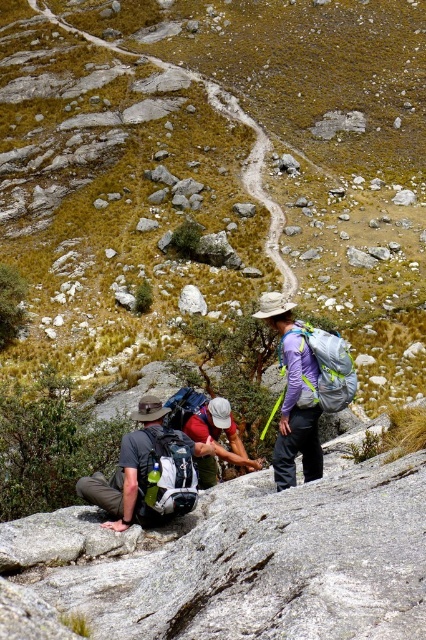
You are a hiker who needs to place a map on the ground between the matte gray backpack at lower left and the white smooth rock at center. Based on their positions, where should you place the map so it is visible to both the backpack and the rock?

The matte gray backpack at lower left is in front of the white smooth rock at center, so placing the map between them would ensure it is visible to both the backpack and the rock.

You are a hiker navigating a steep mountain trail. You come across two markers labeled point 1 at coordinates point (x=97, y=262) and point 2 at coordinates point (x=190, y=298). If you are facing the direction of the trail, which point is closer to you?

Point 2 at coordinates point (x=190, y=298) is closer to you because point 1 at coordinates point (x=97, y=262) is behind it.